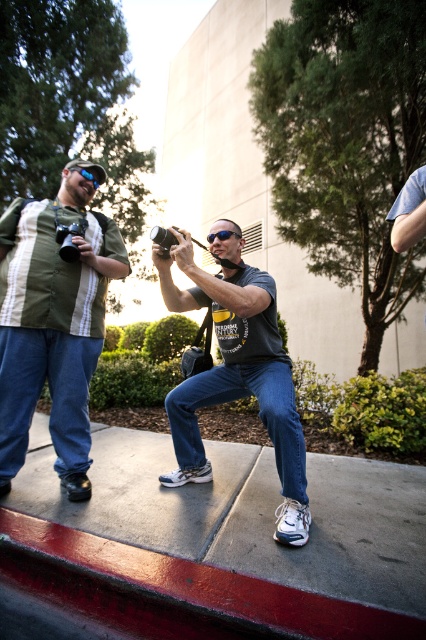
Question: Is matte black camera at center positioned behind black plastic camera at center?

Choices:
 (A) no
 (B) yes

Answer: (B)

Question: Is matte green shirt at left to the left of black plastic camera at center from the viewer's perspective?

Choices:
 (A) no
 (B) yes

Answer: (B)

Question: Can you confirm if matte green shirt at left is positioned below matte gray t-shirt at center?

Choices:
 (A) yes
 (B) no

Answer: (B)

Question: Considering the real-world distances, which object is closest to the matte black camera at center?

Choices:
 (A) matte green shirt at left
 (B) black plastic camera at center

Answer: (A)

Question: Which of the following is the farthest from the observer?

Choices:
 (A) (213, 237)
 (B) (230, 244)

Answer: (A)

Question: Which point is closer to the camera?

Choices:
 (A) (199, 465)
 (B) (74, 445)
 (C) (164, 252)

Answer: (C)